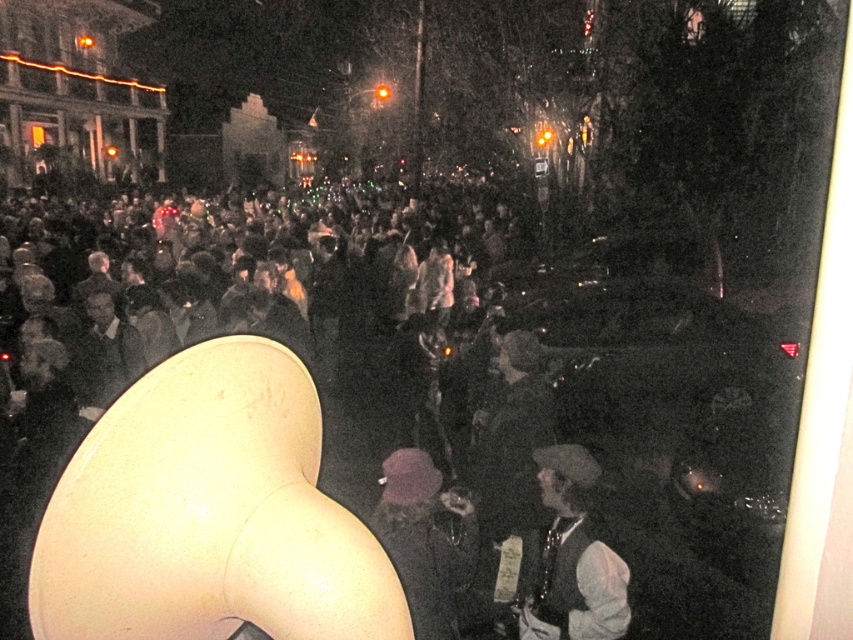
Is the position of white matte megaphone at center less distant than that of purple fabric hat at center?

Yes, it is.

Between white matte megaphone at center and purple fabric hat at center, which one has less height?

With less height is purple fabric hat at center.

What do you see at coordinates (448, 387) in the screenshot? The height and width of the screenshot is (640, 853). I see `white matte megaphone at center` at bounding box center [448, 387].

What are the coordinates of `white matte megaphone at center` in the screenshot? It's located at (448, 387).

Which of these two, white matte megaphone at center or white fabric hat at lower right, stands taller?

With more height is white matte megaphone at center.

Is point (672, 316) positioned before point (622, 604)?

No, it is not.

Does point (709, 400) lie in front of point (543, 460)?

No, it is behind (543, 460).

The height and width of the screenshot is (640, 853). I want to click on white matte megaphone at center, so click(448, 387).

Looking at this image, who is positioned more to the left, white fabric hat at lower right or purple fabric hat at center?

Positioned to the left is purple fabric hat at center.

Which is below, white fabric hat at lower right or purple fabric hat at center?

Positioned lower is white fabric hat at lower right.

Measure the distance between point (544, 618) and camera.

Point (544, 618) is 3.34 meters from camera.

Identify the location of white fabric hat at lower right. The height and width of the screenshot is (640, 853). (572, 557).